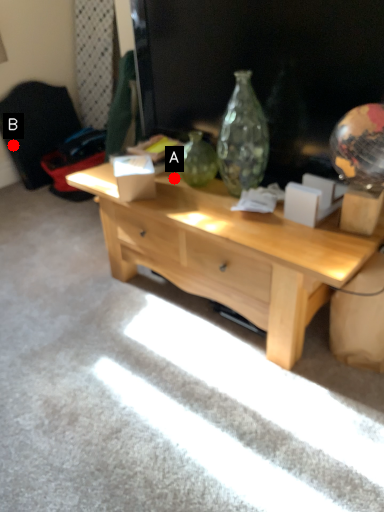
Question: Two points are circled on the image, labeled by A and B beside each circle. Which point is closer to the camera?

Choices:
 (A) A is closer
 (B) B is closer

Answer: (A)